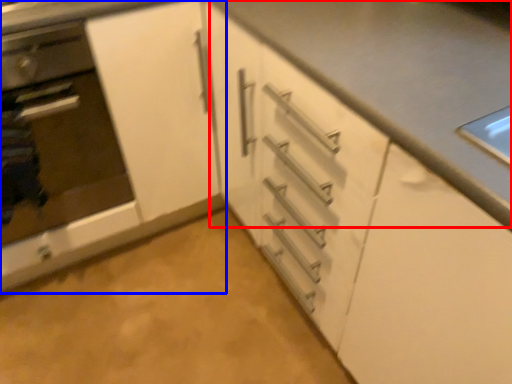
Question: Which object is further to the camera taking this photo, counter top (highlighted by a red box) or cabinetry (highlighted by a blue box)?

Choices:
 (A) counter top
 (B) cabinetry

Answer: (B)